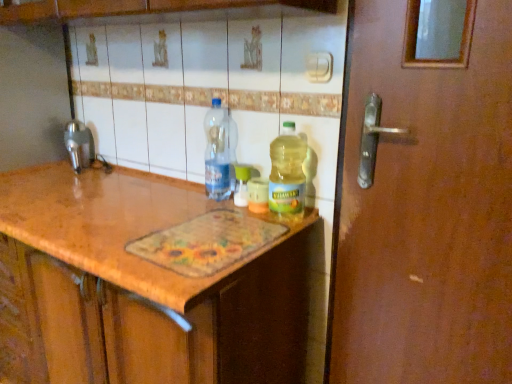
What is the approximate height of brushed metal faucet at left?

The height of brushed metal faucet at left is 8.13 inches.

Image resolution: width=512 pixels, height=384 pixels. Describe the element at coordinates (79, 145) in the screenshot. I see `brushed metal faucet at left` at that location.

The width and height of the screenshot is (512, 384). I want to click on brushed metal faucet at left, so click(x=79, y=145).

Would you say brushed metal faucet at left is part of transparent plastic bottle at center, which appears as the 3th bottle when viewed from the right,'s contents?

No, transparent plastic bottle at center, which appears as the 3th bottle when viewed from the right, does not contain brushed metal faucet at left.

Which is more to the right, transparent plastic bottle at center, the 1th bottle when ordered from left to right, or brushed metal faucet at left?

transparent plastic bottle at center, the 1th bottle when ordered from left to right, is more to the right.

Where is `faucet lying behind the transparent plastic bottle at center, the 1th bottle when ordered from left to right`? The image size is (512, 384). faucet lying behind the transparent plastic bottle at center, the 1th bottle when ordered from left to right is located at coordinates (79, 145).

Looking at this image, between transparent plastic bottle at center, which appears as the 3th bottle when viewed from the right, and brushed metal faucet at left, which one has more height?

Standing taller between the two is transparent plastic bottle at center, which appears as the 3th bottle when viewed from the right.

Does translucent plastic bottle at center, which ranks as the second bottle in left-to-right order, have a lesser height compared to transparent plastic bottle at center, the 1th bottle when ordered from left to right?

Yes.

Is translucent plastic bottle at center, positioned as the 2th bottle in right-to-left order, not inside transparent plastic bottle at center, the 1th bottle when ordered from left to right?

translucent plastic bottle at center, positioned as the 2th bottle in right-to-left order, is positioned outside transparent plastic bottle at center, the 1th bottle when ordered from left to right.

Is point (241, 189) farther from camera compared to point (213, 148)?

That is False.

From the picture: Is the surface of translucent plastic bottle at center, which ranks as the second bottle in left-to-right order, in direct contact with transparent plastic bottle at center, the 1th bottle when ordered from left to right?

Absolutely, translucent plastic bottle at center, which ranks as the second bottle in left-to-right order, is next to and touching transparent plastic bottle at center, the 1th bottle when ordered from left to right.

Which point is more distant from viewer, (234, 173) or (88, 133)?

Point (88, 133)

Which is more to the left, translucent plastic bottle at center, positioned as the 2th bottle in right-to-left order, or brushed metal faucet at left?

Positioned to the left is brushed metal faucet at left.

From the picture: Is translucent plastic bottle at center, positioned as the 2th bottle in right-to-left order, turned away from brushed metal faucet at left?

No, translucent plastic bottle at center, positioned as the 2th bottle in right-to-left order,'s orientation is not away from brushed metal faucet at left.

Would you say translucent plastic bottle at center, positioned as the 2th bottle in right-to-left order, contains brushed metal faucet at left?

No, brushed metal faucet at left is not a part of translucent plastic bottle at center, positioned as the 2th bottle in right-to-left order.

Can you confirm if translucent plastic bottle at center, which is the third bottle from left to right, is smaller than brushed metal faucet at left?

No.

Which object is positioned more to the left, translucent plastic bottle at center, the first bottle viewed from the right, or brushed metal faucet at left?

brushed metal faucet at left.

Between translucent plastic bottle at center, which is the third bottle from left to right, and brushed metal faucet at left, which one has more height?

translucent plastic bottle at center, which is the third bottle from left to right, is taller.

How different are the orientations of translucent plastic bottle at center, the first bottle viewed from the right, and brushed metal faucet at left in degrees?

translucent plastic bottle at center, the first bottle viewed from the right, and brushed metal faucet at left are facing 0.00201 degrees away from each other.

In the image, is transparent plastic bottle at center, the 1th bottle when ordered from left to right, positioned in front of or behind translucent plastic bottle at center, positioned as the 2th bottle in right-to-left order?

transparent plastic bottle at center, the 1th bottle when ordered from left to right, is positioned closer to the viewer than translucent plastic bottle at center, positioned as the 2th bottle in right-to-left order.

Does transparent plastic bottle at center, the 1th bottle when ordered from left to right, have a smaller size compared to translucent plastic bottle at center, positioned as the 2th bottle in right-to-left order?

Actually, transparent plastic bottle at center, the 1th bottle when ordered from left to right, might be larger than translucent plastic bottle at center, positioned as the 2th bottle in right-to-left order.

From a real-world perspective, is transparent plastic bottle at center, the 1th bottle when ordered from left to right, below translucent plastic bottle at center, which ranks as the second bottle in left-to-right order?

No, from a real-world perspective, transparent plastic bottle at center, the 1th bottle when ordered from left to right, is not under translucent plastic bottle at center, which ranks as the second bottle in left-to-right order.

Is transparent plastic bottle at center, the 1th bottle when ordered from left to right, completely or partially outside of translucent plastic bottle at center, which ranks as the second bottle in left-to-right order?

transparent plastic bottle at center, the 1th bottle when ordered from left to right, is positioned outside translucent plastic bottle at center, which ranks as the second bottle in left-to-right order.

From a real-world perspective, which object stands above the other?

transparent plastic bottle at center, the 1th bottle when ordered from left to right.

Considering the relative sizes of translucent plastic bottle at center, the first bottle viewed from the right, and transparent plastic bottle at center, the 1th bottle when ordered from left to right, in the image provided, is translucent plastic bottle at center, the first bottle viewed from the right, smaller than transparent plastic bottle at center, the 1th bottle when ordered from left to right,?

Correct, translucent plastic bottle at center, the first bottle viewed from the right, occupies less space than transparent plastic bottle at center, the 1th bottle when ordered from left to right.

Is translucent plastic bottle at center, which is the third bottle from left to right, oriented away from transparent plastic bottle at center, which appears as the 3th bottle when viewed from the right?

No, translucent plastic bottle at center, which is the third bottle from left to right,'s orientation is not away from transparent plastic bottle at center, which appears as the 3th bottle when viewed from the right.

Measure the distance from brushed metal faucet at left to translucent plastic bottle at center, which is the third bottle from left to right.

brushed metal faucet at left and translucent plastic bottle at center, which is the third bottle from left to right, are 37.05 inches apart.

Considering the positions of objects brushed metal faucet at left and translucent plastic bottle at center, the first bottle viewed from the right, in the image provided, who is more to the right, brushed metal faucet at left or translucent plastic bottle at center, the first bottle viewed from the right,?

translucent plastic bottle at center, the first bottle viewed from the right, is more to the right.

Considering the relative sizes of brushed metal faucet at left and translucent plastic bottle at center, which is the third bottle from left to right, in the image provided, is brushed metal faucet at left taller than translucent plastic bottle at center, which is the third bottle from left to right,?

Incorrect, the height of brushed metal faucet at left is not larger of that of translucent plastic bottle at center, which is the third bottle from left to right.

In terms of width, does brushed metal faucet at left look wider or thinner when compared to translucent plastic bottle at center, which is the third bottle from left to right?

In the image, brushed metal faucet at left appears to be wider than translucent plastic bottle at center, which is the third bottle from left to right.

In order to click on faucet located behind the transparent plastic bottle at center, which appears as the 3th bottle when viewed from the right in this screenshot , I will do `click(79, 145)`.

The width and height of the screenshot is (512, 384). Find the location of `the 2nd bottle directly beneath the transparent plastic bottle at center, which appears as the 3th bottle when viewed from the right (from a real-world perspective)`. the 2nd bottle directly beneath the transparent plastic bottle at center, which appears as the 3th bottle when viewed from the right (from a real-world perspective) is located at coordinates (241, 185).

Looking at the image, which one is located closer to translucent plastic bottle at center, which is the third bottle from left to right, translucent plastic bottle at center, which ranks as the second bottle in left-to-right order, or brushed metal faucet at left?

translucent plastic bottle at center, which ranks as the second bottle in left-to-right order.

Which object lies nearer to the anchor point translucent plastic bottle at center, which ranks as the second bottle in left-to-right order, translucent plastic bottle at center, which is the third bottle from left to right, or brushed metal faucet at left?

translucent plastic bottle at center, which is the third bottle from left to right.

When comparing their distances from brushed metal faucet at left, does translucent plastic bottle at center, the first bottle viewed from the right, or transparent plastic bottle at center, which appears as the 3th bottle when viewed from the right, seem closer?

transparent plastic bottle at center, which appears as the 3th bottle when viewed from the right, is closer to brushed metal faucet at left.

Based on their spatial positions, is translucent plastic bottle at center, positioned as the 2th bottle in right-to-left order, or brushed metal faucet at left closer to transparent plastic bottle at center, the 1th bottle when ordered from left to right?

Based on the image, translucent plastic bottle at center, positioned as the 2th bottle in right-to-left order, appears to be nearer to transparent plastic bottle at center, the 1th bottle when ordered from left to right.

Based on their spatial positions, is transparent plastic bottle at center, the 1th bottle when ordered from left to right, or translucent plastic bottle at center, positioned as the 2th bottle in right-to-left order, closer to brushed metal faucet at left?

transparent plastic bottle at center, the 1th bottle when ordered from left to right.

When comparing their distances from transparent plastic bottle at center, the 1th bottle when ordered from left to right, does translucent plastic bottle at center, which is the third bottle from left to right, or translucent plastic bottle at center, positioned as the 2th bottle in right-to-left order, seem further?

translucent plastic bottle at center, which is the third bottle from left to right, is further to transparent plastic bottle at center, the 1th bottle when ordered from left to right.

Estimate the real-world distances between objects in this image. Which object is closer to brushed metal faucet at left, transparent plastic bottle at center, which appears as the 3th bottle when viewed from the right, or translucent plastic bottle at center, the first bottle viewed from the right?

The object closer to brushed metal faucet at left is transparent plastic bottle at center, which appears as the 3th bottle when viewed from the right.

From the image, which object appears to be nearer to translucent plastic bottle at center, which ranks as the second bottle in left-to-right order, transparent plastic bottle at center, which appears as the 3th bottle when viewed from the right, or brushed metal faucet at left?

transparent plastic bottle at center, which appears as the 3th bottle when viewed from the right.

Where is `bottle between brushed metal faucet at left and translucent plastic bottle at center, positioned as the 2th bottle in right-to-left order, in the horizontal direction`? The image size is (512, 384). bottle between brushed metal faucet at left and translucent plastic bottle at center, positioned as the 2th bottle in right-to-left order, in the horizontal direction is located at coordinates (217, 152).

Where is `bottle situated between transparent plastic bottle at center, which appears as the 3th bottle when viewed from the right, and translucent plastic bottle at center, the first bottle viewed from the right, from left to right`? The height and width of the screenshot is (384, 512). bottle situated between transparent plastic bottle at center, which appears as the 3th bottle when viewed from the right, and translucent plastic bottle at center, the first bottle viewed from the right, from left to right is located at coordinates (241, 185).